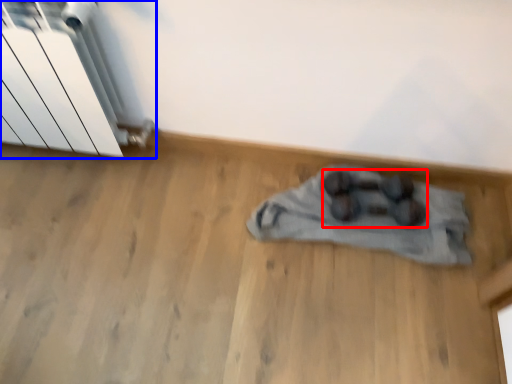
Question: Which of the following is the closest to the observer, footwear (highlighted by a red box) or radiator (highlighted by a blue box)?

Choices:
 (A) footwear
 (B) radiator

Answer: (B)